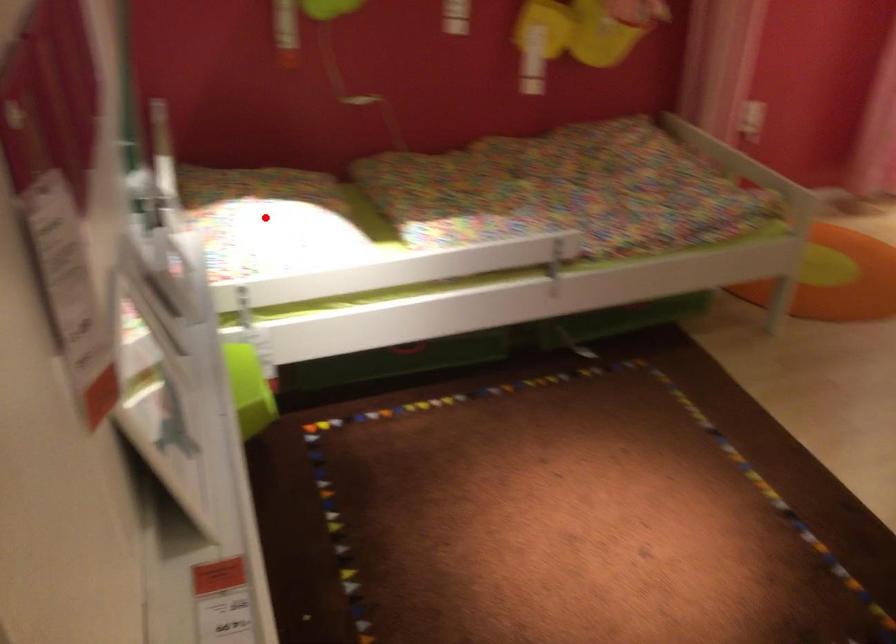
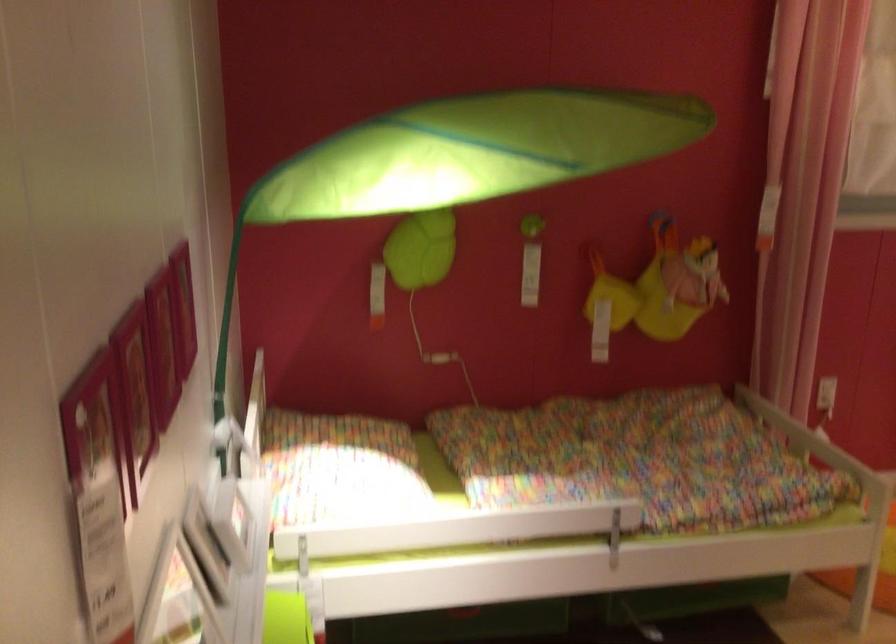
Where in the second image is the point corresponding to the highlighted location from the first image?

(339, 468)